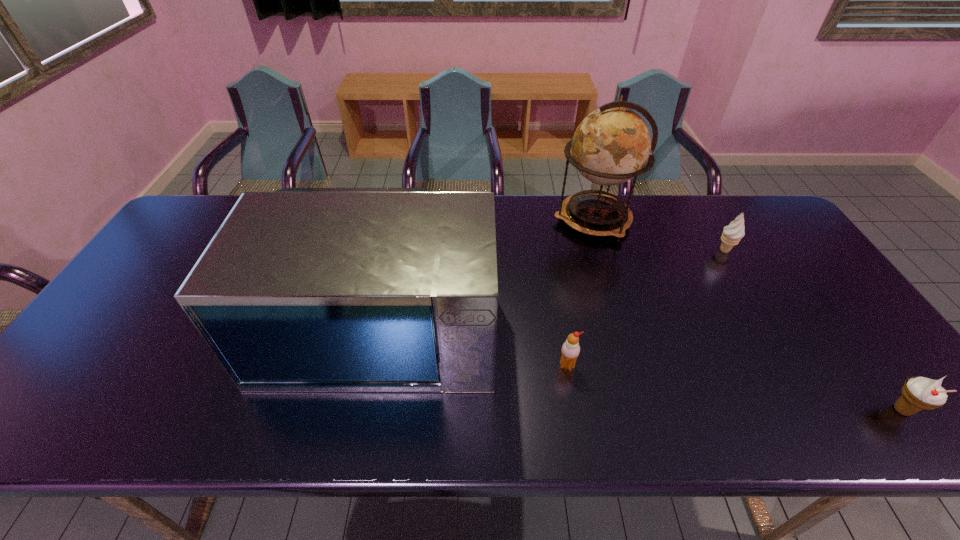
Identify the location of object that is at the near edge. The height and width of the screenshot is (540, 960). point(918,393).

Locate an element on the screen. The height and width of the screenshot is (540, 960). object present at the right edge is located at coordinates (918, 393).

The height and width of the screenshot is (540, 960). In order to click on object present at the near right corner in this screenshot , I will do `click(918, 393)`.

Locate an element on the screen. Image resolution: width=960 pixels, height=540 pixels. vacant space at the far edge of the desktop is located at coordinates (530, 217).

Locate an element on the screen. vacant space at the near edge of the desktop is located at coordinates (222, 418).

This screenshot has width=960, height=540. What are the coordinates of `vacant space at the left edge of the desktop` in the screenshot? It's located at (135, 288).

In the image, there is a desktop. Identify the location of vacant space at the right edge. The height and width of the screenshot is (540, 960). (843, 338).

Locate an element on the screen. The height and width of the screenshot is (540, 960). vacant area at the far right corner is located at coordinates (733, 215).

Identify the location of blank region between the second farthest icecream and the globe. This screenshot has width=960, height=540. (580, 293).

The width and height of the screenshot is (960, 540). In order to click on free space between the tallest object and the second icecream from right to left in this screenshot , I will do `click(659, 235)`.